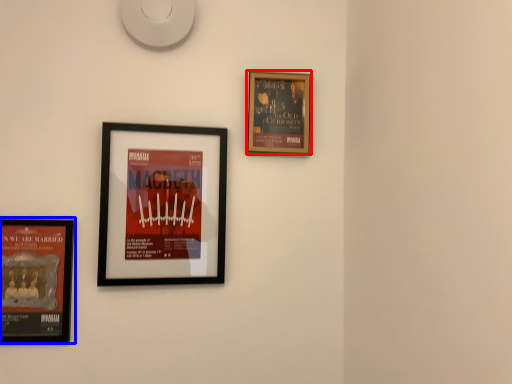
Question: Which point is further to the camera, picture frame (highlighted by a red box) or picture frame (highlighted by a blue box)?

Choices:
 (A) picture frame
 (B) picture frame

Answer: (A)